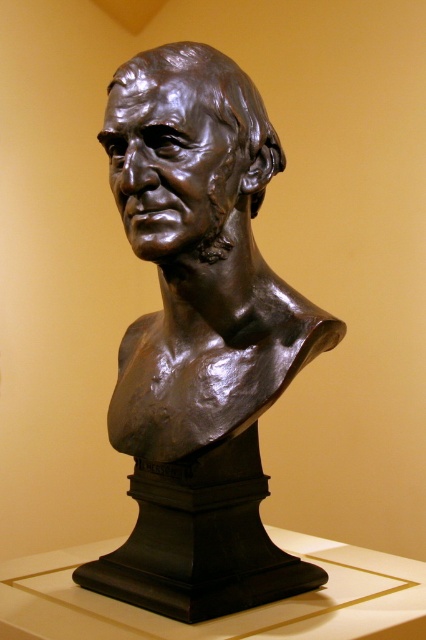
Does point (230, 433) come farther from viewer compared to point (226, 172)?

Yes, it is.

Who is positioned more to the left, matte bronze bust at center or bronze bust at center?

Positioned to the left is matte bronze bust at center.

Is point (241, 106) positioned in front of point (201, 152)?

That is False.

The height and width of the screenshot is (640, 426). In order to click on matte bronze bust at center in this screenshot , I will do `click(199, 339)`.